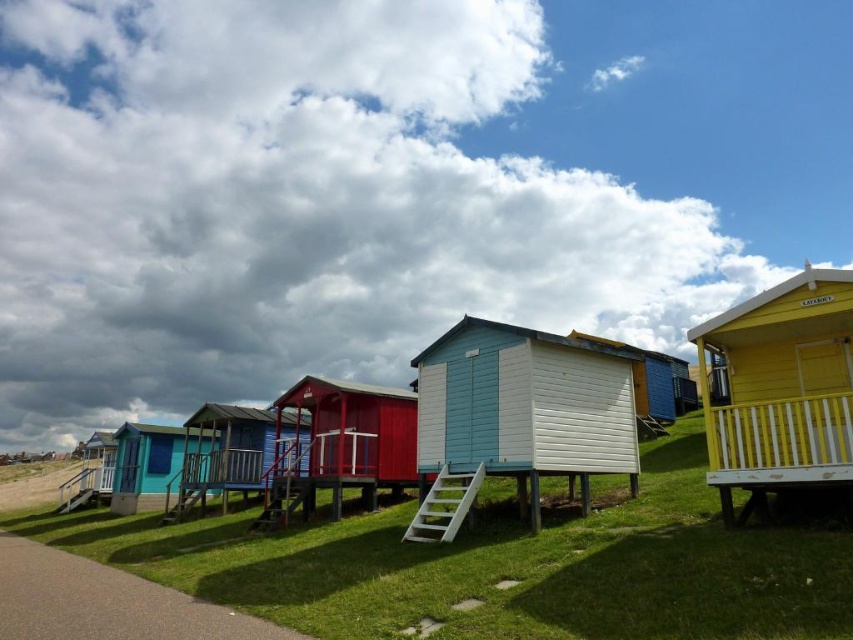
Can you confirm if light blue wooden beach hut at center is smaller than matte blue wooden hut at center?

Yes.

Is point (537, 381) closer to viewer compared to point (134, 465)?

Yes, it is in front of point (134, 465).

Identify the location of light blue wooden beach hut at center. (524, 408).

Where is `yellow painted wood beach hut at right`? This screenshot has width=853, height=640. yellow painted wood beach hut at right is located at coordinates (781, 388).

Which is behind, point (830, 438) or point (219, 417)?

The point (219, 417) is more distant.

Is point (811, 352) positioned in front of point (254, 438)?

Yes, it is.

The image size is (853, 640). I want to click on yellow painted wood beach hut at right, so click(781, 388).

Between point (361, 440) and point (196, 461), which one is positioned behind?

Point (196, 461)

Does matte red cabin at center have a smaller size compared to matte blue cabin at center?

Yes, matte red cabin at center is smaller than matte blue cabin at center.

Where is `matte red cabin at center`? This screenshot has width=853, height=640. matte red cabin at center is located at coordinates click(x=341, y=444).

You are a GUI agent. You are given a task and a screenshot of the screen. Output one action in this format:
    pyautogui.click(x=<x>, y=<y>)
    Task: Click on the matte red cabin at center
    The width and height of the screenshot is (853, 640).
    Given the screenshot: What is the action you would take?
    pyautogui.click(x=341, y=444)